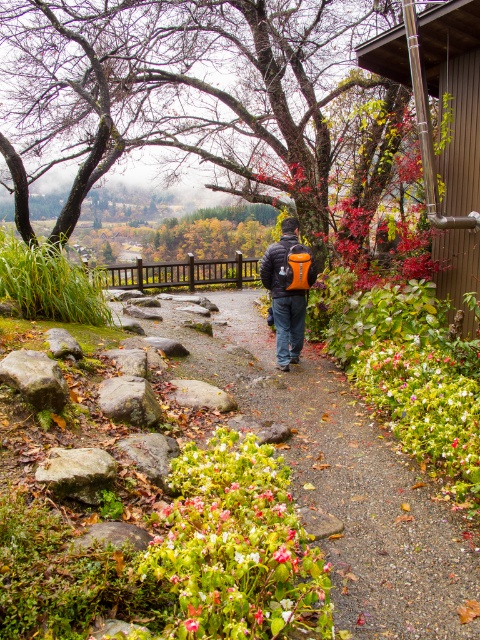
Does orange fabric backpack at center have a greater width compared to orange matte jacket at center?

Correct, the width of orange fabric backpack at center exceeds that of orange matte jacket at center.

Between orange fabric backpack at center and orange matte jacket at center, which one appears on the right side from the viewer's perspective?

orange fabric backpack at center

Locate an element on the screen. Image resolution: width=480 pixels, height=640 pixels. orange fabric backpack at center is located at coordinates (287, 291).

This screenshot has height=640, width=480. In order to click on orange fabric backpack at center in this screenshot , I will do `click(287, 291)`.

Can you confirm if gravel path at center is thinner than orange fabric backpack at center?

No.

The height and width of the screenshot is (640, 480). What do you see at coordinates (343, 477) in the screenshot?
I see `gravel path at center` at bounding box center [343, 477].

Locate an element on the screen. This screenshot has width=480, height=640. gravel path at center is located at coordinates (343, 477).

Does green leafy plant at center have a larger size compared to orange fabric backpack at center?

Actually, green leafy plant at center might be smaller than orange fabric backpack at center.

Between green leafy plant at center and orange fabric backpack at center, which one appears on the right side from the viewer's perspective?

From the viewer's perspective, orange fabric backpack at center appears more on the right side.

Between point (316, 568) and point (295, 333), which one is positioned behind?

The point (295, 333) is behind.

Where is `green leafy plant at center`? The height and width of the screenshot is (640, 480). green leafy plant at center is located at coordinates (237, 547).